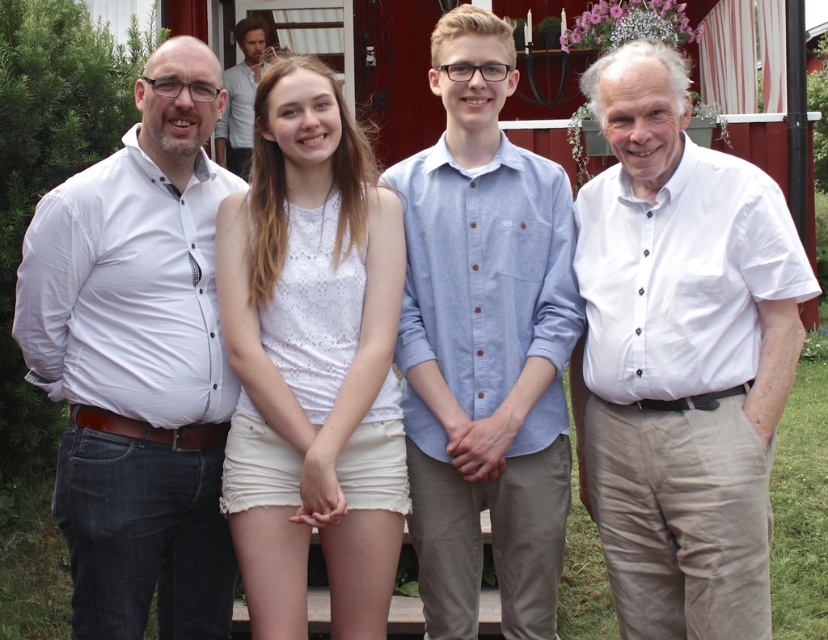
Between point (730, 467) and point (220, 236), which one is positioned behind?

The point (220, 236) is more distant.

What do you see at coordinates (680, 356) in the screenshot?
I see `white cotton shirt at right` at bounding box center [680, 356].

Locate an element on the screen. The height and width of the screenshot is (640, 828). white cotton shirt at right is located at coordinates (680, 356).

Describe the element at coordinates (484, 342) in the screenshot. I see `light blue chambray shirt at center` at that location.

Who is more forward, (482, 312) or (302, 490)?

Point (302, 490)

This screenshot has width=828, height=640. I want to click on light blue chambray shirt at center, so click(x=484, y=342).

Consider the image. Who is lower down, white cotton shirt at right or smooth brown hair at upper center?

white cotton shirt at right

Who is more distant from viewer, (691, 212) or (224, 113)?

The point (224, 113) is behind.

I want to click on white cotton shirt at right, so click(680, 356).